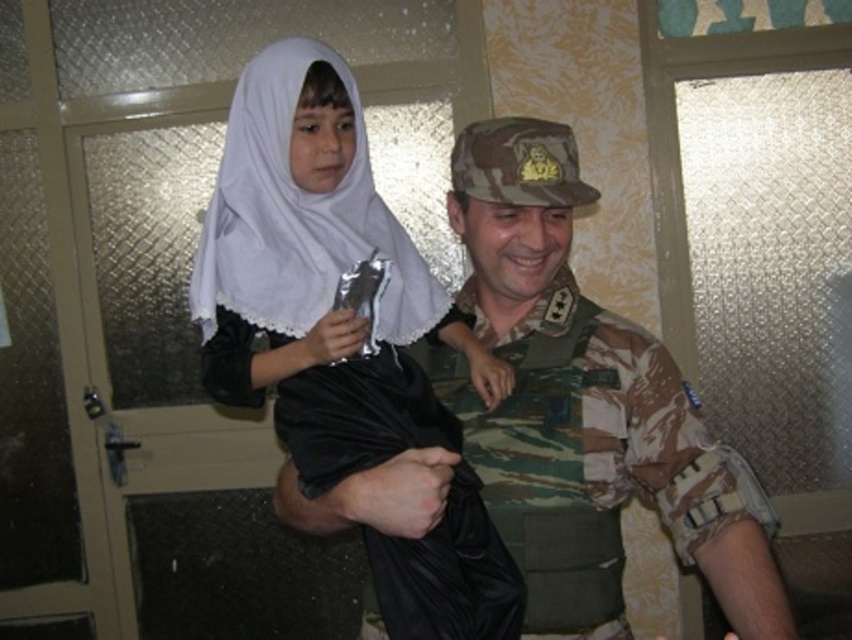
Does white satin hijab at center have a smaller size compared to white sheer veil at upper left?

No, white satin hijab at center is not smaller than white sheer veil at upper left.

Which is below, white satin hijab at center or white sheer veil at upper left?

white satin hijab at center

Who is more forward, (395,556) or (222,225)?

Positioned in front is point (395,556).

This screenshot has width=852, height=640. I want to click on white satin hijab at center, so point(318,278).

Which is more to the right, camouflage uniform at center or white sheer veil at upper left?

From the viewer's perspective, camouflage uniform at center appears more on the right side.

What do you see at coordinates (678, 474) in the screenshot? The height and width of the screenshot is (640, 852). I see `camouflage uniform at center` at bounding box center [678, 474].

Find the location of a particular element. camouflage uniform at center is located at coordinates (678, 474).

Locate an element on the screen. This screenshot has height=640, width=852. camouflage uniform at center is located at coordinates (678, 474).

Does point (413, 445) come closer to viewer compared to point (499, 272)?

Yes, point (413, 445) is in front of point (499, 272).

From the picture: Who is more forward, (256, 256) or (672, 472)?

Positioned in front is point (672, 472).

Locate an element on the screen. This screenshot has height=640, width=852. white satin hijab at center is located at coordinates (318, 278).

This screenshot has width=852, height=640. I want to click on white satin hijab at center, so click(x=318, y=278).